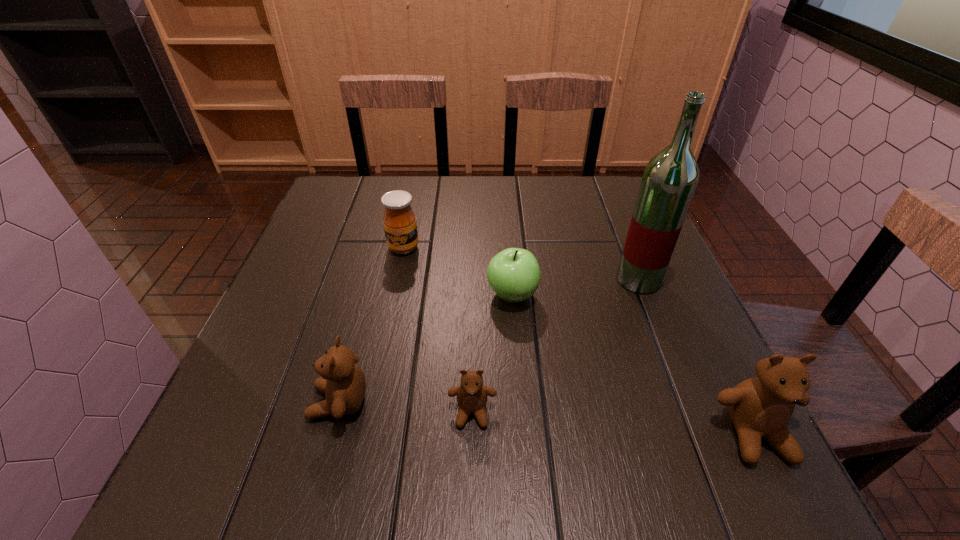
Identify the location of the leftmost teddy bear. The height and width of the screenshot is (540, 960). (342, 381).

What are the coordinates of `the shortest object` in the screenshot? It's located at [x=472, y=395].

Where is `the second teddy bear from left to right`? The width and height of the screenshot is (960, 540). the second teddy bear from left to right is located at coordinates (472, 395).

This screenshot has height=540, width=960. What are the coordinates of `the rightmost teddy bear` in the screenshot? It's located at (760, 407).

Where is `liquor`? This screenshot has width=960, height=540. liquor is located at coordinates (670, 178).

Identify the location of the fifth tallest object. (514, 275).

The image size is (960, 540). I want to click on the farthest object, so click(x=400, y=225).

The image size is (960, 540). I want to click on vacant space situated 0.140m on the front-facing side of the second tallest teddy bear, so click(x=231, y=402).

Where is `free space located on the front-facing side of the second tallest teddy bear`? The height and width of the screenshot is (540, 960). free space located on the front-facing side of the second tallest teddy bear is located at coordinates (271, 402).

You are a GUI agent. You are given a task and a screenshot of the screen. Output one action in this format:
    pyautogui.click(x=<x>, y=<y>)
    Task: Click on the free space located 0.140m on the front of the tallest object
    
    Given the screenshot: What is the action you would take?
    click(664, 345)